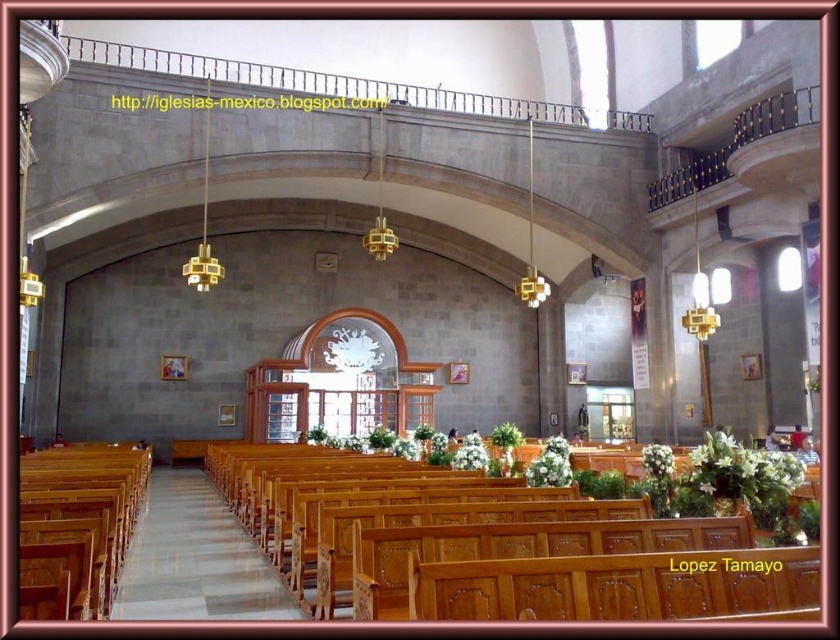
Question: Which object is positioned farthest from the white floral arrangement at center?

Choices:
 (A) white matte flower at center
 (B) white matte floral arrangement at center

Answer: (A)

Question: Which object appears closest to the camera in this image?

Choices:
 (A) white matte flower at center
 (B) white floral arrangement at center
 (C) white matte floral arrangement at center

Answer: (B)

Question: From the image, what is the correct spatial relationship of white floral arrangement at center in relation to white matte flower at center?

Choices:
 (A) below
 (B) above

Answer: (A)

Question: Which object appears farthest from the camera in this image?

Choices:
 (A) white matte floral arrangement at center
 (B) white floral arrangement at center

Answer: (A)

Question: Observing the image, what is the correct spatial positioning of white floral arrangement at center in reference to white matte flower at center?

Choices:
 (A) right
 (B) left

Answer: (B)

Question: Can you confirm if white floral arrangement at center is positioned above white matte floral arrangement at center?

Choices:
 (A) no
 (B) yes

Answer: (A)